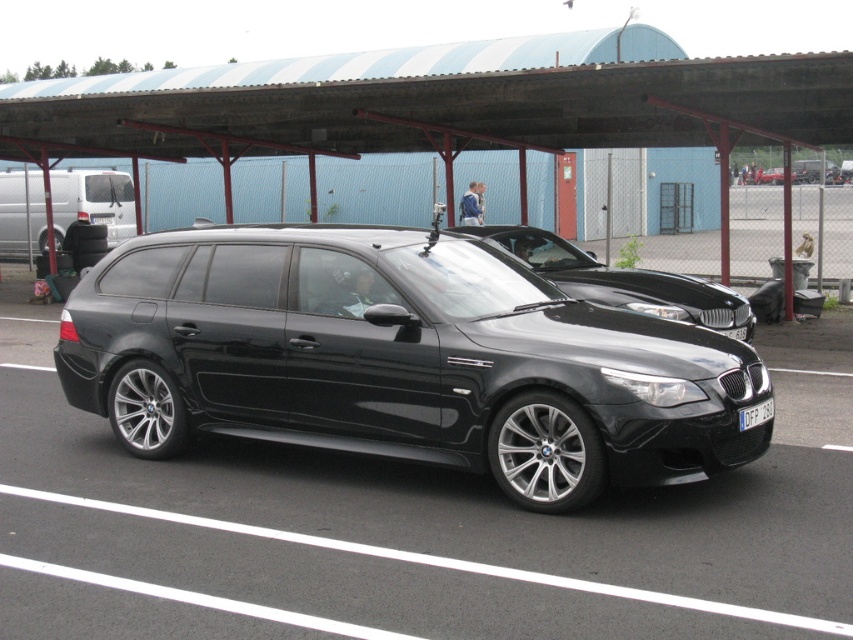
Who is more forward, (698, 141) or (729, 326)?

Point (729, 326)

Who is shorter, blue/white striped roof at upper center or black metallic car at center?

Standing shorter between the two is black metallic car at center.

This screenshot has height=640, width=853. In order to click on blue/white striped roof at upper center in this screenshot , I will do `click(439, 108)`.

Can you confirm if black metallic car at center is bigger than matte silver van at left?

No, black metallic car at center is not bigger than matte silver van at left.

Between point (556, 282) and point (77, 173), which one is positioned in front?

Point (556, 282)

This screenshot has width=853, height=640. I want to click on black metallic car at center, so click(621, 280).

Is point (244, 147) positioned in front of point (73, 170)?

Yes, it is.

Is blue/white striped roof at upper center smaller than matte silver van at left?

Incorrect, blue/white striped roof at upper center is not smaller in size than matte silver van at left.

Who is more distant from viewer, (260, 116) or (113, 189)?

Point (113, 189)

The height and width of the screenshot is (640, 853). In order to click on blue/white striped roof at upper center in this screenshot , I will do `click(439, 108)`.